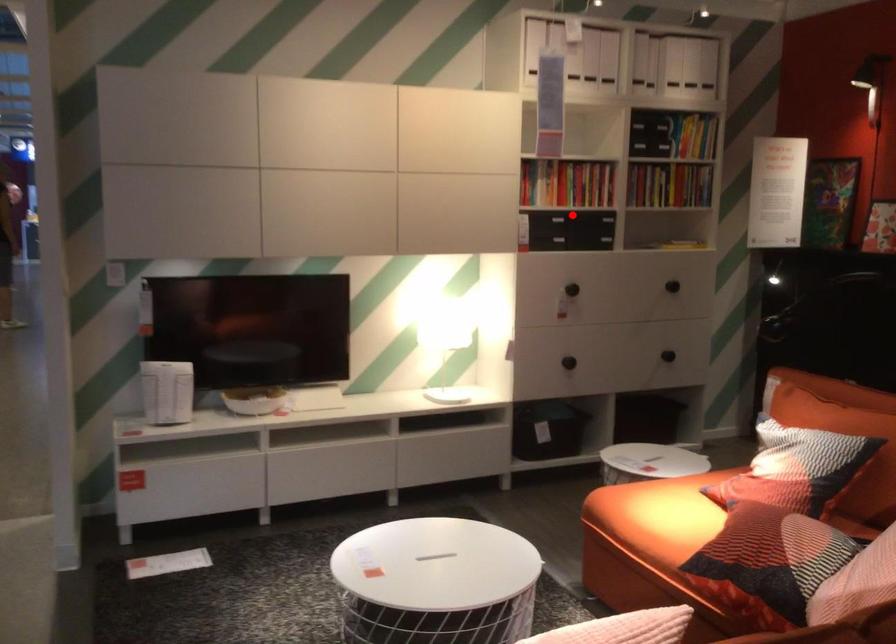
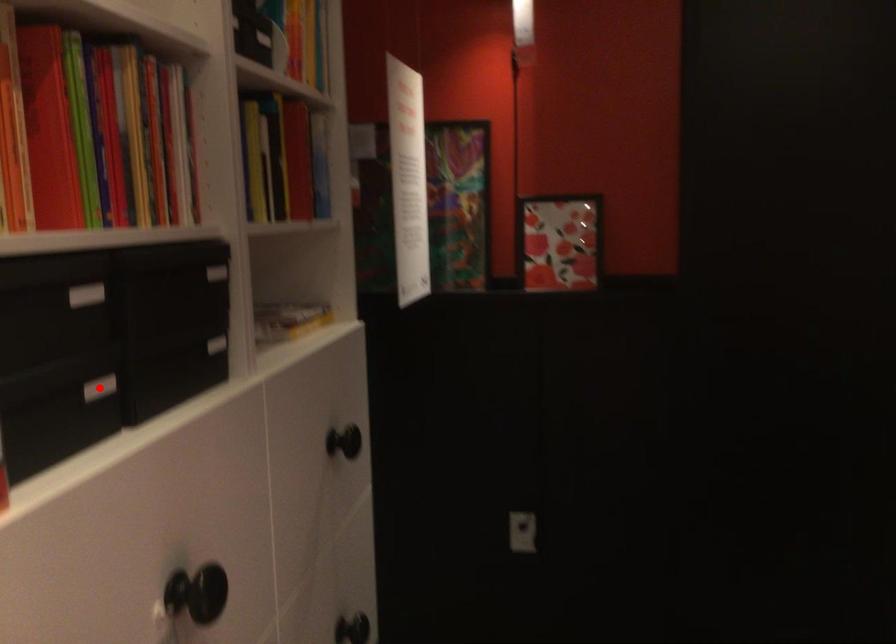
I am providing you with two images of the same scene from different viewpoints. A red point is marked on the first image and another point is marked on the second image. Is the red point in image1 aligned with the point shown in image2?

Yes